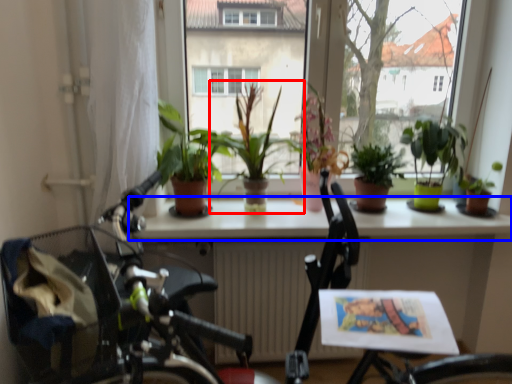
Question: Which point is further to the camera, houseplant (highlighted by a red box) or window sill (highlighted by a blue box)?

Choices:
 (A) houseplant
 (B) window sill

Answer: (B)